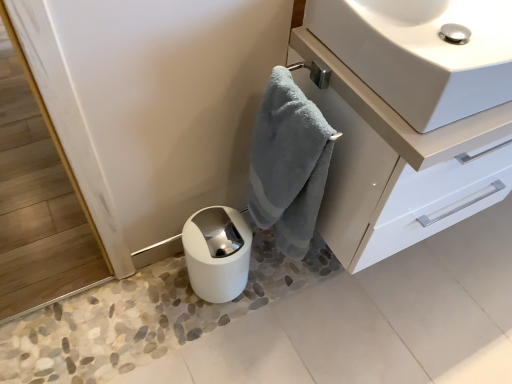
Question: Considering the positions of white glossy sink at upper right and soft blue towel at center in the image, is white glossy sink at upper right wider or thinner than soft blue towel at center?

Choices:
 (A) wide
 (B) thin

Answer: (A)

Question: Is white glossy sink at upper right spatially inside soft blue towel at center, or outside of it?

Choices:
 (A) outside
 (B) inside

Answer: (A)

Question: Which of these objects is positioned closest to the white glossy paper towel at lower center?

Choices:
 (A) soft blue towel at center
 (B) glossy white cabinet at upper right
 (C) white glossy sink at upper right

Answer: (A)

Question: Which of these objects is positioned farthest from the white glossy paper towel at lower center?

Choices:
 (A) soft blue towel at center
 (B) white glossy sink at upper right
 (C) glossy white cabinet at upper right

Answer: (B)